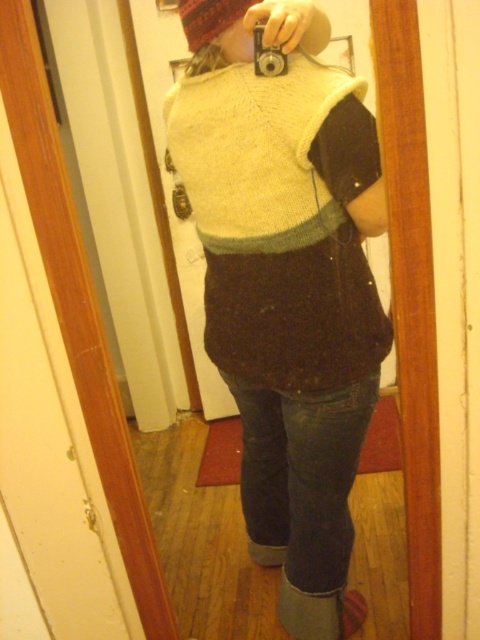
Question: Which point is farther to the camera?

Choices:
 (A) fuzzy woolen hat at upper center
 (B) knitted sweater at center

Answer: (B)

Question: Which point is farther to the camera?

Choices:
 (A) silver metallic camera at upper center
 (B) fuzzy woolen hat at upper center

Answer: (A)

Question: In this image, where is white knitted sweater at center located relative to fuzzy woolen hat at upper center?

Choices:
 (A) above
 (B) below

Answer: (B)

Question: Does knitted sweater at center come behind white knitted sweater at center?

Choices:
 (A) yes
 (B) no

Answer: (B)

Question: Can you confirm if knitted sweater at center is positioned to the left of silver metallic camera at upper center?

Choices:
 (A) no
 (B) yes

Answer: (A)

Question: Which point appears farthest from the camera in this image?

Choices:
 (A) (298, 74)
 (B) (229, 36)

Answer: (B)